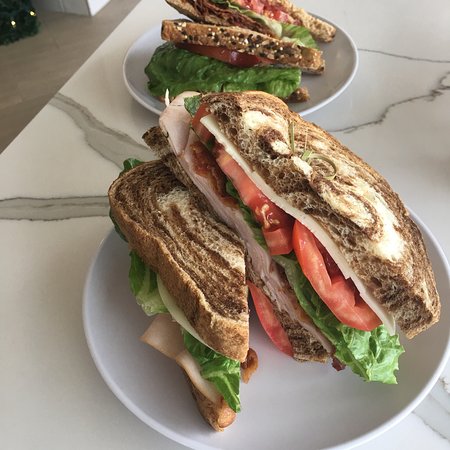
Find the location of a particular element. This screenshot has height=450, width=450. marble countertop is located at coordinates (100, 125), (387, 39), (416, 124), (427, 419), (79, 390).